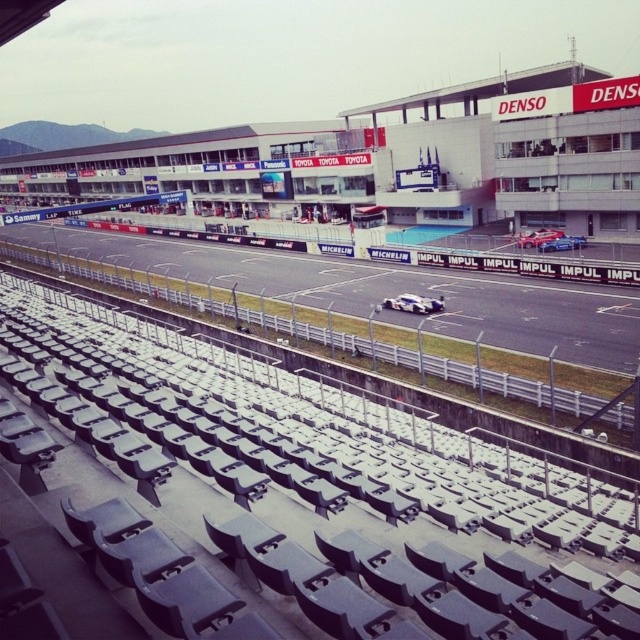
You are a photographer at the motorsport venue and want to capture both the white matte race car at center and the blue metallic car at center in a single shot. Considering their sizes, which car should you focus on to ensure both are visible in the frame?

The white matte race car at center is larger than the blue metallic car at center, so focusing on the white matte race car at center would allow both to be visible as the larger car will take up more space, but the smaller blue metallic car at center can still fit into the frame alongside it.

You are a drone operator trying to capture aerial footage of the motorsport venue. You need to fly your drone from point A at point (541, 301) to point B at point (577, 237). Considering the drone must stay above the track at all times, which point is closer to the camera so you can adjust your flight path accordingly?

Point (541, 301) is closer to the camera than point (577, 237), so you should adjust your flight path to ensure the drone ascends as it moves from point A to point B to maintain altitude above the track.

You are standing at the starting line of the motorsport venue. Looking towards the black asphalt race track at center, where exactly would you see it located in terms of coordinates?

The black asphalt race track at center is located at coordinates point (385, 291).